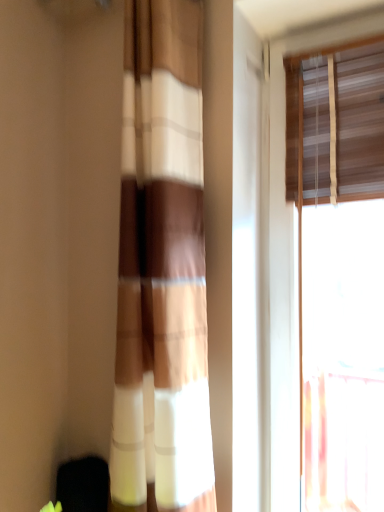
Question: Is wooden blinds at upper right further to the viewer compared to brown textured curtain at center?

Choices:
 (A) yes
 (B) no

Answer: (A)

Question: Does wooden blinds at upper right have a greater height compared to brown textured curtain at center?

Choices:
 (A) yes
 (B) no

Answer: (A)

Question: Is wooden blinds at upper right located outside brown textured curtain at center?

Choices:
 (A) yes
 (B) no

Answer: (A)

Question: From a real-world perspective, is wooden blinds at upper right located beneath brown textured curtain at center?

Choices:
 (A) no
 (B) yes

Answer: (B)

Question: Is wooden blinds at upper right placed right next to brown textured curtain at center?

Choices:
 (A) yes
 (B) no

Answer: (B)

Question: From the image's perspective, does wooden blinds at upper right appear higher than brown textured curtain at center?

Choices:
 (A) no
 (B) yes

Answer: (A)

Question: Is brown textured curtain at center aimed at wooden blinds at upper right?

Choices:
 (A) no
 (B) yes

Answer: (A)

Question: Are brown textured curtain at center and wooden blinds at upper right located far from each other?

Choices:
 (A) yes
 (B) no

Answer: (B)

Question: Is brown textured curtain at center outside of wooden blinds at upper right?

Choices:
 (A) yes
 (B) no

Answer: (A)

Question: From the image's perspective, is brown textured curtain at center below wooden blinds at upper right?

Choices:
 (A) no
 (B) yes

Answer: (A)

Question: Can you confirm if brown textured curtain at center is wider than wooden blinds at upper right?

Choices:
 (A) no
 (B) yes

Answer: (B)

Question: Are brown textured curtain at center and wooden blinds at upper right beside each other?

Choices:
 (A) no
 (B) yes

Answer: (A)

Question: Choose the correct answer: Is wooden blinds at upper right inside brown textured curtain at center or outside it?

Choices:
 (A) inside
 (B) outside

Answer: (B)